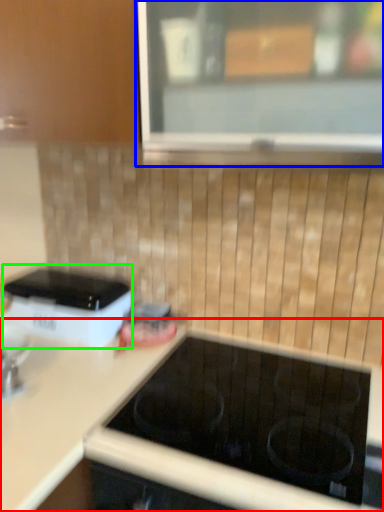
Question: Estimate the real-world distances between objects in this image. Which object is farther from countertop (highlighted by a red box), window (highlighted by a blue box) or home appliance (highlighted by a green box)?

Choices:
 (A) window
 (B) home appliance

Answer: (A)